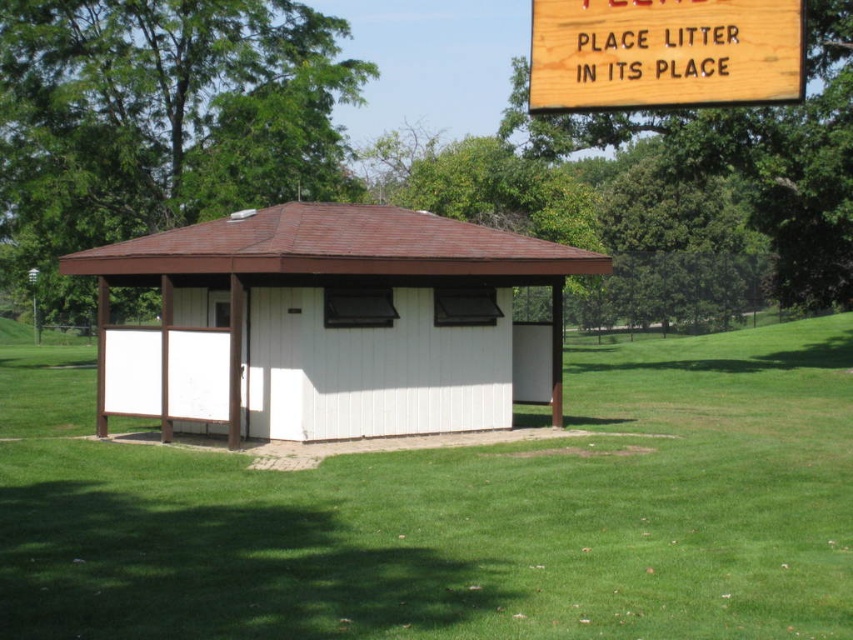
From the picture: Does white wood hut at center have a lesser height compared to wooden sign at upper right?

Incorrect, white wood hut at center's height does not fall short of wooden sign at upper right's.

Looking at this image, which is below, white wood hut at center or wooden sign at upper right?

Positioned lower is white wood hut at center.

Does point (560, 288) lie behind point (728, 76)?

Yes, it is behind point (728, 76).

Identify the location of white wood hut at center. (331, 323).

Does green grass at center have a larger size compared to wooden sign at upper right?

Correct, green grass at center is larger in size than wooden sign at upper right.

The width and height of the screenshot is (853, 640). What do you see at coordinates (474, 518) in the screenshot? I see `green grass at center` at bounding box center [474, 518].

Locate an element on the screen. This screenshot has height=640, width=853. green grass at center is located at coordinates (474, 518).

You are a GUI agent. You are given a task and a screenshot of the screen. Output one action in this format:
    pyautogui.click(x=<x>, y=<y>)
    Task: Click on the green grass at center
    
    Given the screenshot: What is the action you would take?
    pyautogui.click(x=474, y=518)

Does point (657, 570) come farther from viewer compared to point (352, 230)?

No, it is not.

Can you confirm if green grass at center is shorter than white wood hut at center?

Correct, green grass at center is not as tall as white wood hut at center.

Describe the element at coordinates (474, 518) in the screenshot. I see `green grass at center` at that location.

Identify the location of green grass at center. (474, 518).